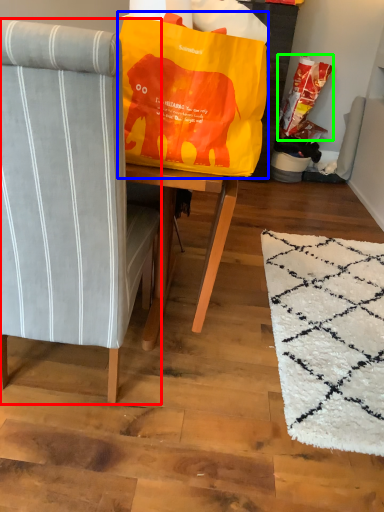
Question: Based on their relative distances, which object is farther from chair (highlighted by a red box)? Choose from bean bag chair (highlighted by a blue box) and grocery bag (highlighted by a green box).

Choices:
 (A) bean bag chair
 (B) grocery bag

Answer: (B)